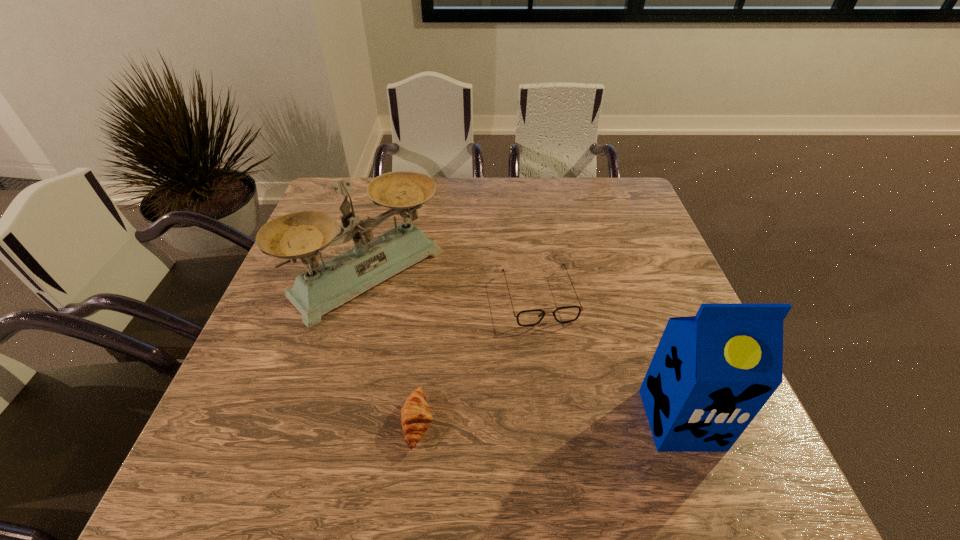
This screenshot has width=960, height=540. Identify the location of pastry. (416, 416).

This screenshot has width=960, height=540. Identify the location of the tallest object. (711, 374).

At what (x,y) coordinates should I click in order to perform the action: click on carton. Please return your answer as a coordinate pair (x, y). The height and width of the screenshot is (540, 960). Looking at the image, I should click on (711, 374).

You are a GUI agent. You are given a task and a screenshot of the screen. Output one action in this format:
    pyautogui.click(x=<x>, y=<y>)
    Task: Click on the scale
    This screenshot has height=540, width=960.
    Given the screenshot: What is the action you would take?
    pyautogui.click(x=323, y=287)

Find the location of a particular element. the second object from right to left is located at coordinates (566, 314).

The height and width of the screenshot is (540, 960). What are the coordinates of `free space located 0.170m on the front-facing side of the shortest object` in the screenshot? It's located at (522, 422).

Identify the location of vacant area located on the front-facing side of the scale. The width and height of the screenshot is (960, 540). (475, 369).

You are a GUI agent. You are given a task and a screenshot of the screen. Output one action in this format:
    pyautogui.click(x=<x>, y=<y>)
    Task: Click on the free spot located 0.280m on the front-facing side of the scale
    
    Given the screenshot: What is the action you would take?
    pyautogui.click(x=495, y=387)

Locate an element on the screen. Image resolution: width=960 pixels, height=540 pixels. vacant point located 0.330m on the front-facing side of the scale is located at coordinates pos(513,403).

Locate an element on the screen. free space located 0.110m on the front-facing side of the sunglasses is located at coordinates (560, 367).